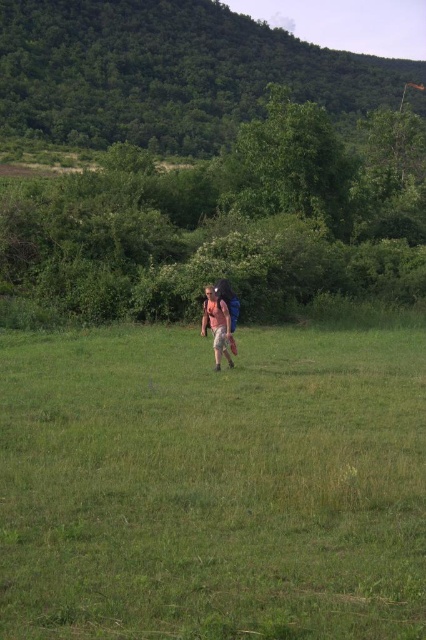
Can you confirm if green grass at center is positioned above green leafy hillside at upper center?

No, green grass at center is not above green leafy hillside at upper center.

Which is more to the right, green grass at center or green leafy hillside at upper center?

Positioned to the right is green leafy hillside at upper center.

The width and height of the screenshot is (426, 640). I want to click on green grass at center, so click(213, 484).

Identify the location of green leafy hillside at upper center. (167, 72).

Between green leafy hillside at upper center and light pink fabric backpack at center, which one is positioned higher?

Positioned higher is green leafy hillside at upper center.

Does point (207, 29) lie behind point (215, 362)?

Yes, point (207, 29) is farther from viewer.

Where is `green leafy hillside at upper center`? The image size is (426, 640). green leafy hillside at upper center is located at coordinates (167, 72).

Can you confirm if green grass at center is shorter than light pink fabric backpack at center?

Yes.

Where is `green grass at center`? green grass at center is located at coordinates (213, 484).

You are a GUI agent. You are given a task and a screenshot of the screen. Output one action in this format:
    pyautogui.click(x=<x>, y=<y>)
    Task: Click on the green grass at center
    Image resolution: width=426 pixels, height=640 pixels.
    Given the screenshot: What is the action you would take?
    pyautogui.click(x=213, y=484)